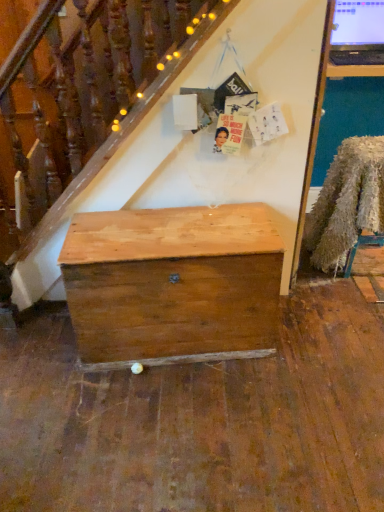
This screenshot has width=384, height=512. What do you see at coordinates (172, 284) in the screenshot? I see `natural wood chest at center` at bounding box center [172, 284].

This screenshot has height=512, width=384. I want to click on natural wood chest at center, so click(x=172, y=284).

In order to face natural wood chest at center, should I rotate leftwards or rightwards?

It's best to rotate left around 2.368 degrees.

This screenshot has width=384, height=512. What are the coordinates of `fuzzy fabric chair at right` in the screenshot? It's located at (347, 202).

Describe the element at coordinates (347, 202) in the screenshot. I see `fuzzy fabric chair at right` at that location.

Where is `natural wood chest at center`? Image resolution: width=384 pixels, height=512 pixels. natural wood chest at center is located at coordinates (172, 284).

From the picture: Does natural wood chest at center appear on the right side of fuzzy fabric chair at right?

No.

Is natural wood chest at center closer to camera compared to fuzzy fabric chair at right?

Yes, natural wood chest at center is closer to the viewer.

Considering the points (157, 342) and (376, 184), which point is behind, point (157, 342) or point (376, 184)?

The point (376, 184) is farther.

From the image's perspective, which is above, natural wood chest at center or fuzzy fabric chair at right?

fuzzy fabric chair at right, from the image's perspective.

From a real-world perspective, who is located lower, natural wood chest at center or fuzzy fabric chair at right?

In real-world perspective, natural wood chest at center is lower.

Which of these two, natural wood chest at center or fuzzy fabric chair at right, is thinner?

natural wood chest at center is thinner.

Who is taller, natural wood chest at center or fuzzy fabric chair at right?

Standing taller between the two is fuzzy fabric chair at right.

Between natural wood chest at center and fuzzy fabric chair at right, which one has smaller size?

fuzzy fabric chair at right.

Is natural wood chest at center surrounding fuzzy fabric chair at right?

No.

Are natural wood chest at center and fuzzy fabric chair at right making contact?

They are not placed beside each other.

Is natural wood chest at center oriented towards fuzzy fabric chair at right?

No, natural wood chest at center is not aimed at fuzzy fabric chair at right.

How much distance is there between natural wood chest at center and fuzzy fabric chair at right?

A distance of 38.10 inches exists between natural wood chest at center and fuzzy fabric chair at right.

Locate an element on the screen. This screenshot has height=512, width=384. desk that is below the fuzzy fabric chair at right (from the image's perspective) is located at coordinates (172, 284).

Which object is positioned more to the left, fuzzy fabric chair at right or natural wood chest at center?

Positioned to the left is natural wood chest at center.

In the image, is fuzzy fabric chair at right positioned in front of or behind natural wood chest at center?

Visually, fuzzy fabric chair at right is located behind natural wood chest at center.

Does point (359, 150) come closer to viewer compared to point (249, 323)?

That is False.

From the image's perspective, is fuzzy fabric chair at right beneath natural wood chest at center?

Actually, fuzzy fabric chair at right appears above natural wood chest at center in the image.

From a real-world perspective, which is physically above, fuzzy fabric chair at right or natural wood chest at center?

fuzzy fabric chair at right.

Which of these two, fuzzy fabric chair at right or natural wood chest at center, is thinner?

Thinner between the two is natural wood chest at center.

Between fuzzy fabric chair at right and natural wood chest at center, which one has more height?

fuzzy fabric chair at right is taller.

Does fuzzy fabric chair at right have a smaller size compared to natural wood chest at center?

Correct, fuzzy fabric chair at right occupies less space than natural wood chest at center.

Is natural wood chest at center located within fuzzy fabric chair at right?

No, fuzzy fabric chair at right does not contain natural wood chest at center.

Would you consider fuzzy fabric chair at right to be distant from natural wood chest at center?

fuzzy fabric chair at right is actually quite close to natural wood chest at center.

Is fuzzy fabric chair at right positioned with its back to natural wood chest at center?

fuzzy fabric chair at right does not have its back to natural wood chest at center.

There is a natural wood chest at center. At what (x,y) coordinates should I click in order to perform the action: click on chair above it (from a real-world perspective). Please return your answer as a coordinate pair (x, y). Looking at the image, I should click on (347, 202).

At what (x,y) coordinates should I click in order to perform the action: click on chair on the right of natural wood chest at center. Please return your answer as a coordinate pair (x, y). This screenshot has width=384, height=512. Looking at the image, I should click on (347, 202).

The height and width of the screenshot is (512, 384). What are the coordinates of `desk on the left of fuzzy fabric chair at right` in the screenshot? It's located at (172, 284).